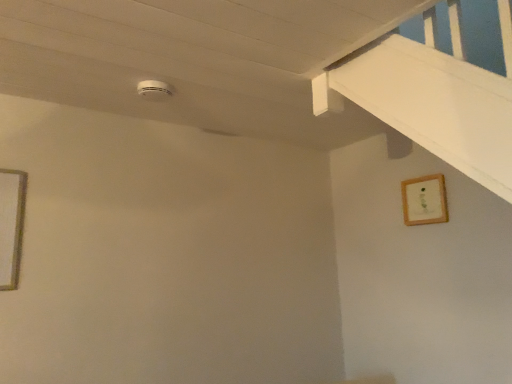
Where is `wooden picture frame at right`? Image resolution: width=512 pixels, height=384 pixels. wooden picture frame at right is located at coordinates (424, 200).

What do you see at coordinates (424, 200) in the screenshot?
I see `wooden picture frame at right` at bounding box center [424, 200].

What is the approximate height of wooden picture frame at right?

wooden picture frame at right is 9.99 inches tall.

This screenshot has height=384, width=512. What are the coordinates of `wooden picture frame at right` in the screenshot? It's located at (424, 200).